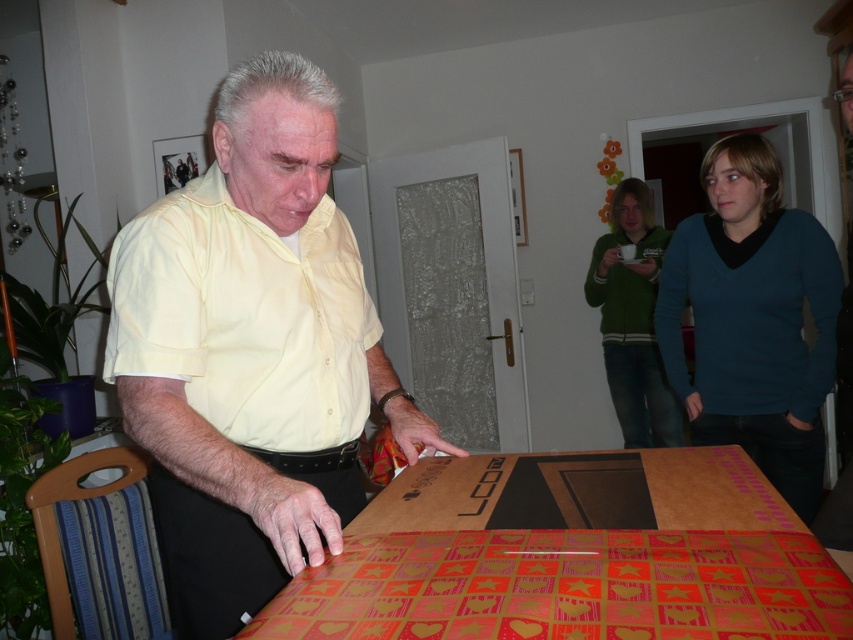
Question: Does cardboard wrapping paper at lower center appear under teal sweater at center?

Choices:
 (A) no
 (B) yes

Answer: (B)

Question: Is yellow matte shirt at center further to the viewer compared to green fleece jacket at upper center?

Choices:
 (A) no
 (B) yes

Answer: (A)

Question: Which of the following is the farthest from the observer?

Choices:
 (A) (218, 328)
 (B) (602, 481)
 (C) (694, 237)
 (D) (648, 220)

Answer: (D)

Question: In this image, where is teal sweater at center located relative to green fleece jacket at upper center?

Choices:
 (A) above
 (B) below

Answer: (B)

Question: Estimate the real-world distances between objects in this image. Which object is closer to the green fleece jacket at upper center?

Choices:
 (A) yellow cotton shirt at center
 (B) yellow matte shirt at center

Answer: (A)

Question: Which point is farther from the camera taking this photo?

Choices:
 (A) (595, 500)
 (B) (747, 132)
 (C) (659, 410)

Answer: (C)